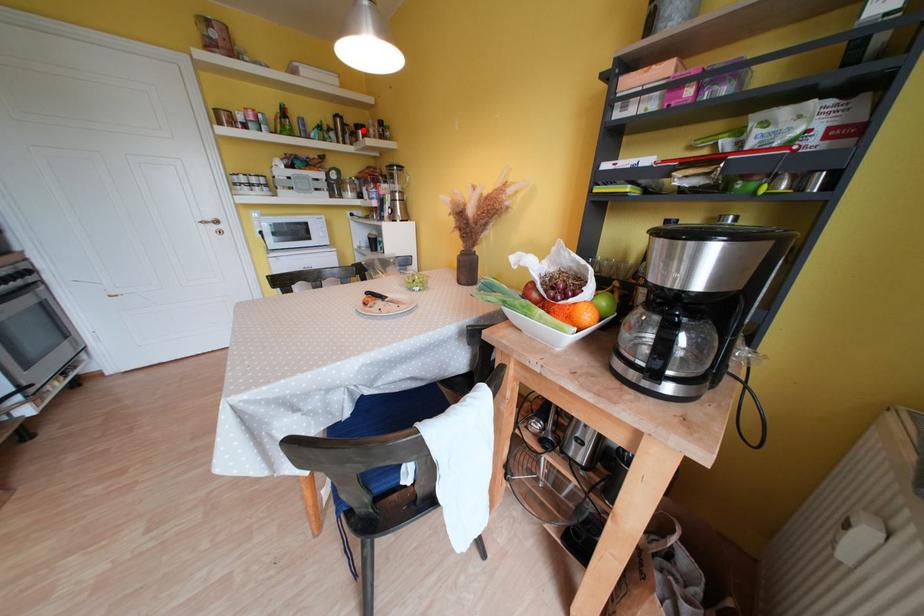
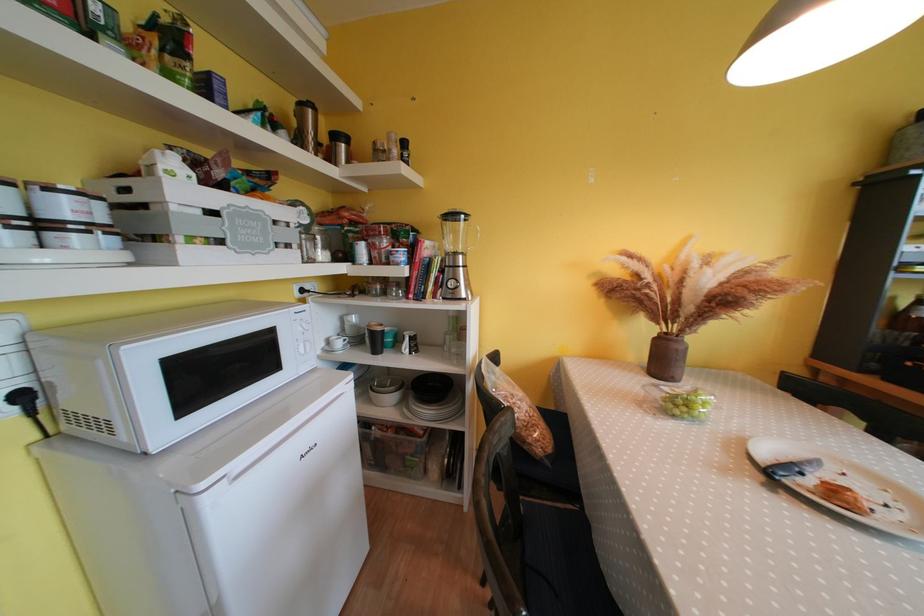
In the second image, find the point that corresponds to the highlighted location in the first image.

(342, 140)